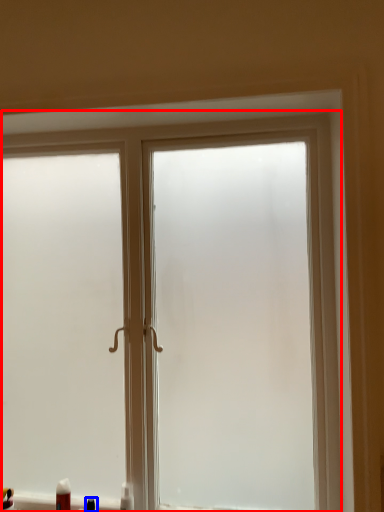
Question: Which point is further to the camera, window (highlighted by a red box) or toiletry (highlighted by a blue box)?

Choices:
 (A) window
 (B) toiletry

Answer: (B)